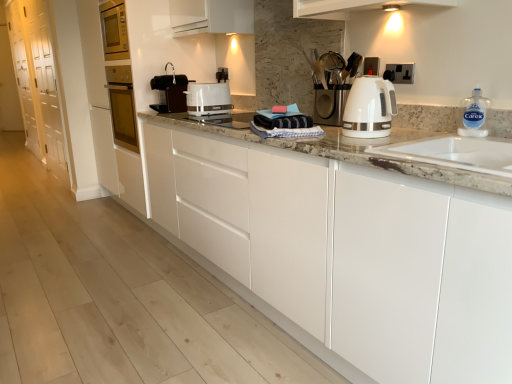
The height and width of the screenshot is (384, 512). I want to click on free space to the left of clear plastic bottle at right, so click(430, 135).